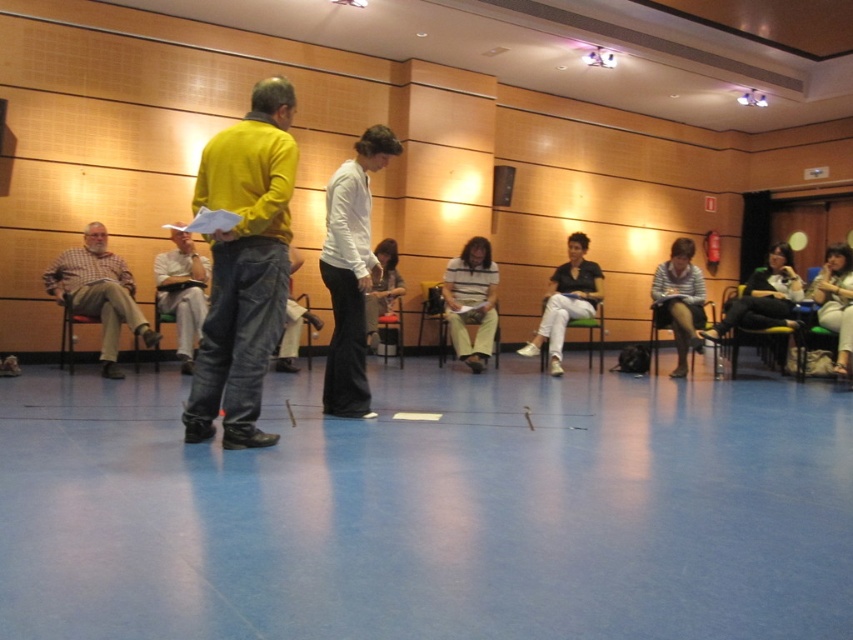
Question: Among these points, which one is farthest from the camera?

Choices:
 (A) (283, 364)
 (B) (654, 337)
 (C) (837, 365)

Answer: (B)

Question: Which of these objects is positioned farthest from the white shirt at center?

Choices:
 (A) checkered fabric shirt at left
 (B) jeans at center
 (C) white cotton pants at center
 (D) brown fabric chair at left

Answer: (B)

Question: From the image, what is the correct spatial relationship of white shirt at center in relation to metallic silver chair at center?

Choices:
 (A) above
 (B) below

Answer: (A)

Question: Does white cotton pants at center appear over black plastic chair at right?

Choices:
 (A) no
 (B) yes

Answer: (B)

Question: Which point appears farthest from the camera in this image?

Choices:
 (A) (120, 296)
 (B) (331, 337)
 (C) (397, 342)
 (D) (722, 342)

Answer: (C)

Question: Is white smooth shirt at center positioned behind checkered fabric shirt at left?

Choices:
 (A) no
 (B) yes

Answer: (A)